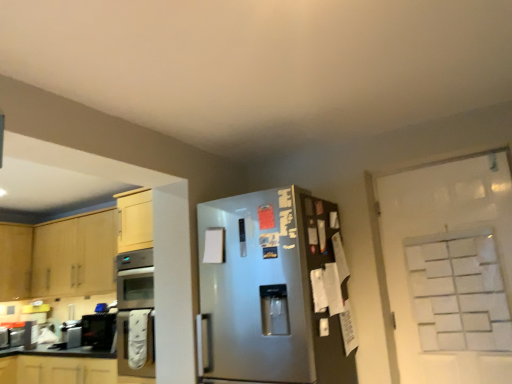
Question: Is brushed metal toaster at lower left, placed as the second appliance when sorted from front to back, situated inside matte white cabinets at lower left, which ranks as the second cabinetry in top-to-bottom order, or outside?

Choices:
 (A) outside
 (B) inside

Answer: (A)

Question: In the image, is brushed metal toaster at lower left, placed as the second appliance when sorted from front to back, positioned in front of or behind matte white cabinets at lower left, which is counted as the first cabinetry, starting from the bottom?

Choices:
 (A) behind
 (B) front

Answer: (A)

Question: Estimate the real-world distances between objects in this image. Which object is closer to the white matte glass door at upper right?

Choices:
 (A) brushed metal toaster at lower left, the 2th appliance viewed from the back
 (B) brushed metal toaster at lower left, placed as the second appliance when sorted from front to back
 (C) light wood cabinet at left, which ranks as the 1th cabinetry in top-to-bottom order
 (D) white paperboard at right
 (E) satin silver refrigerator at center

Answer: (D)

Question: Which of these objects is positioned closest to the white matte glass door at upper right?

Choices:
 (A) brushed metal toaster at lower left, the 2th appliance viewed from the back
 (B) satin silver refrigerator at center
 (C) white paperboard at right
 (D) brushed metal toaster at lower left, placed as the second appliance when sorted from front to back
 (E) matte white cabinets at lower left, which ranks as the second cabinetry in top-to-bottom order

Answer: (C)